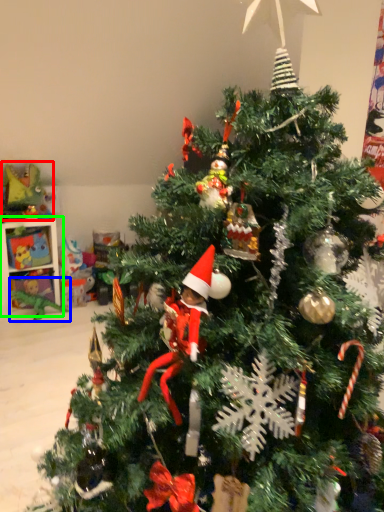
Question: Considering the real-world distances, which object is closest to toy (highlighted by a red box)? toy (highlighted by a blue box) or shelf (highlighted by a green box).

Choices:
 (A) toy
 (B) shelf

Answer: (B)